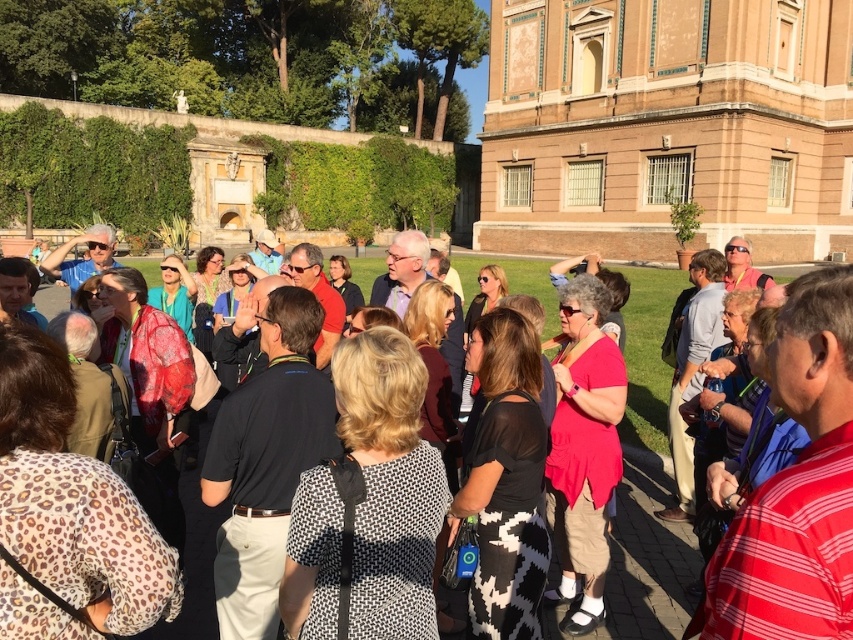
You are standing in the park and see a group of people. There is a point marked at coordinates (175,292). What object is located at that point?

The point at coordinates (175,292) corresponds to the matte teal shirt at center.

You are a photographer at the park event and need to capture both the leopard print dress at lower left and the black dotted dress at center in a single shot. Which dress should you focus on first to ensure both are in frame?

The leopard print dress at lower left is in front of the black dotted dress at center, so focusing on the leopard print dress at lower left first will ensure both are in frame as the black dotted dress at center is behind it.

You are a photographer trying to capture a clear shot of the matte teal shirt at center and the matte black shirt at center. Since you want both subjects to be in focus, which one should you focus on first?

You should focus on the matte teal shirt at center first because it is in front of the matte black shirt at center, so adjusting focus from the front to the back will help both be in focus.